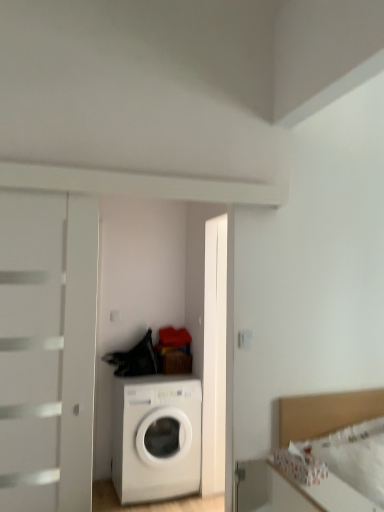
Question: Is white glossy washing machine at center turned away from white fabric bed at lower right?

Choices:
 (A) yes
 (B) no

Answer: (B)

Question: Considering the relative sizes of white glossy washing machine at center and white fabric bed at lower right in the image provided, is white glossy washing machine at center shorter than white fabric bed at lower right?

Choices:
 (A) no
 (B) yes

Answer: (A)

Question: Is white glossy washing machine at center smaller than white fabric bed at lower right?

Choices:
 (A) yes
 (B) no

Answer: (B)

Question: Is the depth of white glossy washing machine at center greater than that of white fabric bed at lower right?

Choices:
 (A) yes
 (B) no

Answer: (A)

Question: Is white glossy washing machine at center not within white fabric bed at lower right?

Choices:
 (A) no
 (B) yes

Answer: (B)

Question: Could you tell me if white glossy washing machine at center is facing white fabric bed at lower right?

Choices:
 (A) no
 (B) yes

Answer: (B)

Question: Considering the relative sizes of white fabric bed at lower right and white glossy washing machine at center in the image provided, is white fabric bed at lower right smaller than white glossy washing machine at center?

Choices:
 (A) no
 (B) yes

Answer: (B)

Question: Does white fabric bed at lower right lie in front of white glossy washing machine at center?

Choices:
 (A) yes
 (B) no

Answer: (A)

Question: From a real-world perspective, is white fabric bed at lower right located higher than white glossy washing machine at center?

Choices:
 (A) no
 (B) yes

Answer: (B)

Question: Is white fabric bed at lower right next to white glossy washing machine at center?

Choices:
 (A) no
 (B) yes

Answer: (A)

Question: Is white fabric bed at lower right to the left of white glossy washing machine at center from the viewer's perspective?

Choices:
 (A) no
 (B) yes

Answer: (A)

Question: Can you confirm if white fabric bed at lower right is shorter than white glossy washing machine at center?

Choices:
 (A) no
 (B) yes

Answer: (B)

Question: From their relative heights in the image, would you say white glossy washing machine at center is taller or shorter than white fabric bed at lower right?

Choices:
 (A) short
 (B) tall

Answer: (B)